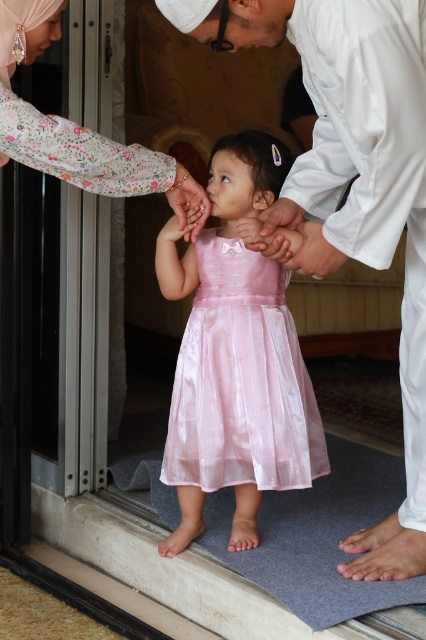
Question: Is shiny pink dress at center to the right of pink satin hand at center from the viewer's perspective?

Choices:
 (A) no
 (B) yes

Answer: (B)

Question: Among these objects, which one is farthest from the camera?

Choices:
 (A) pink satin hand at center
 (B) shiny pink dress at center

Answer: (B)

Question: Which point is closer to the camera?

Choices:
 (A) shiny pink dress at center
 (B) white satin shirt at center
 (C) pink satin hand at center

Answer: (B)

Question: Can you confirm if white satin shirt at center is thinner than pink satin hand at center?

Choices:
 (A) no
 (B) yes

Answer: (A)

Question: Which object is the closest to the pink satin hand at center?

Choices:
 (A) white satin shirt at center
 (B) shiny pink dress at center

Answer: (B)

Question: Is white satin shirt at center closer to the viewer compared to shiny pink dress at center?

Choices:
 (A) yes
 (B) no

Answer: (A)